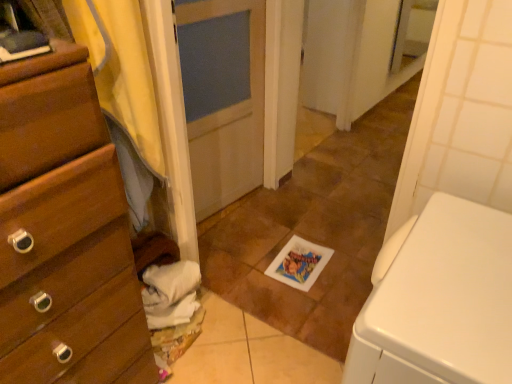
Question: From a real-world perspective, is white glossy tile at center located higher than white cotton towels at lower left?

Choices:
 (A) no
 (B) yes

Answer: (A)

Question: Considering the relative sizes of white glossy tile at center and white cotton towels at lower left in the image provided, is white glossy tile at center shorter than white cotton towels at lower left?

Choices:
 (A) no
 (B) yes

Answer: (B)

Question: Could you tell me if white glossy tile at center is turned towards white cotton towels at lower left?

Choices:
 (A) no
 (B) yes

Answer: (A)

Question: Does white glossy tile at center lie in front of white cotton towels at lower left?

Choices:
 (A) no
 (B) yes

Answer: (A)

Question: Is white glossy tile at center at the left side of white cotton towels at lower left?

Choices:
 (A) yes
 (B) no

Answer: (B)

Question: Relative to yellow fabric at left, is white glossy tile at center in front or behind?

Choices:
 (A) behind
 (B) front

Answer: (A)

Question: Considering the positions of white glossy tile at center and yellow fabric at left in the image, is white glossy tile at center taller or shorter than yellow fabric at left?

Choices:
 (A) short
 (B) tall

Answer: (A)

Question: From the image's perspective, is white glossy tile at center located above or below yellow fabric at left?

Choices:
 (A) above
 (B) below

Answer: (A)

Question: Looking at their shapes, would you say white glossy tile at center is wider or thinner than yellow fabric at left?

Choices:
 (A) thin
 (B) wide

Answer: (B)

Question: Is wooden chest of drawers at left in front of or behind white cotton towels at lower left in the image?

Choices:
 (A) front
 (B) behind

Answer: (A)

Question: Considering the positions of wooden chest of drawers at left and white cotton towels at lower left in the image, is wooden chest of drawers at left wider or thinner than white cotton towels at lower left?

Choices:
 (A) wide
 (B) thin

Answer: (A)

Question: Is point (98, 177) closer or farther from the camera than point (169, 268)?

Choices:
 (A) farther
 (B) closer

Answer: (B)

Question: From their relative heights in the image, would you say wooden chest of drawers at left is taller or shorter than white cotton towels at lower left?

Choices:
 (A) tall
 (B) short

Answer: (A)

Question: Is point (112, 48) positioned closer to the camera than point (229, 268)?

Choices:
 (A) closer
 (B) farther

Answer: (A)

Question: From a real-world perspective, is yellow fabric at left physically located above or below white glossy tile at center?

Choices:
 (A) above
 (B) below

Answer: (A)